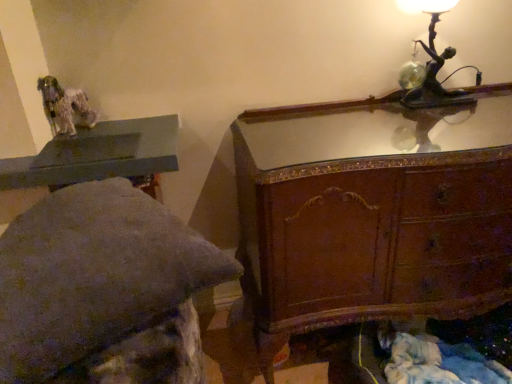
Question: Does wooden chest of drawers at upper right have a smaller size compared to matte gray table at upper left?

Choices:
 (A) no
 (B) yes

Answer: (A)

Question: Is wooden chest of drawers at upper right positioned beyond the bounds of matte gray table at upper left?

Choices:
 (A) no
 (B) yes

Answer: (B)

Question: From the image's perspective, does wooden chest of drawers at upper right appear higher than matte gray table at upper left?

Choices:
 (A) yes
 (B) no

Answer: (B)

Question: Is wooden chest of drawers at upper right far away from matte gray table at upper left?

Choices:
 (A) no
 (B) yes

Answer: (A)

Question: From a real-world perspective, is wooden chest of drawers at upper right below matte gray table at upper left?

Choices:
 (A) yes
 (B) no

Answer: (A)

Question: Are wooden chest of drawers at upper right and matte gray table at upper left beside each other?

Choices:
 (A) yes
 (B) no

Answer: (B)

Question: Would you say wooden chest of drawers at upper right is outside bronze metallic table lamp at upper right?

Choices:
 (A) no
 (B) yes

Answer: (B)

Question: Is wooden chest of drawers at upper right at the left side of bronze metallic table lamp at upper right?

Choices:
 (A) no
 (B) yes

Answer: (B)

Question: Is wooden chest of drawers at upper right positioned before bronze metallic table lamp at upper right?

Choices:
 (A) no
 (B) yes

Answer: (B)

Question: Is wooden chest of drawers at upper right thinner than bronze metallic table lamp at upper right?

Choices:
 (A) yes
 (B) no

Answer: (B)

Question: Does wooden chest of drawers at upper right have a greater width compared to bronze metallic table lamp at upper right?

Choices:
 (A) yes
 (B) no

Answer: (A)

Question: Is wooden chest of drawers at upper right positioned with its back to bronze metallic table lamp at upper right?

Choices:
 (A) no
 (B) yes

Answer: (A)

Question: Can bronze metallic table lamp at upper right be found inside matte gray stone bench at upper left?

Choices:
 (A) no
 (B) yes

Answer: (A)